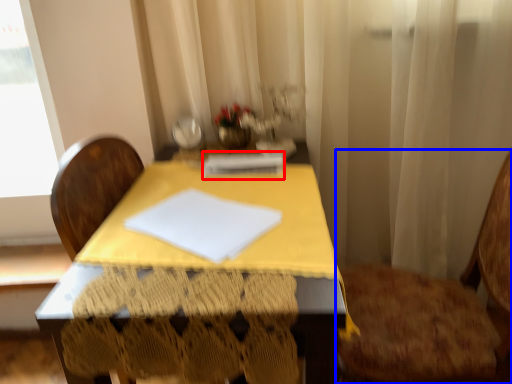
Question: Which of the following is the farthest to the observer, notebook (highlighted by a red box) or chair (highlighted by a blue box)?

Choices:
 (A) notebook
 (B) chair

Answer: (A)